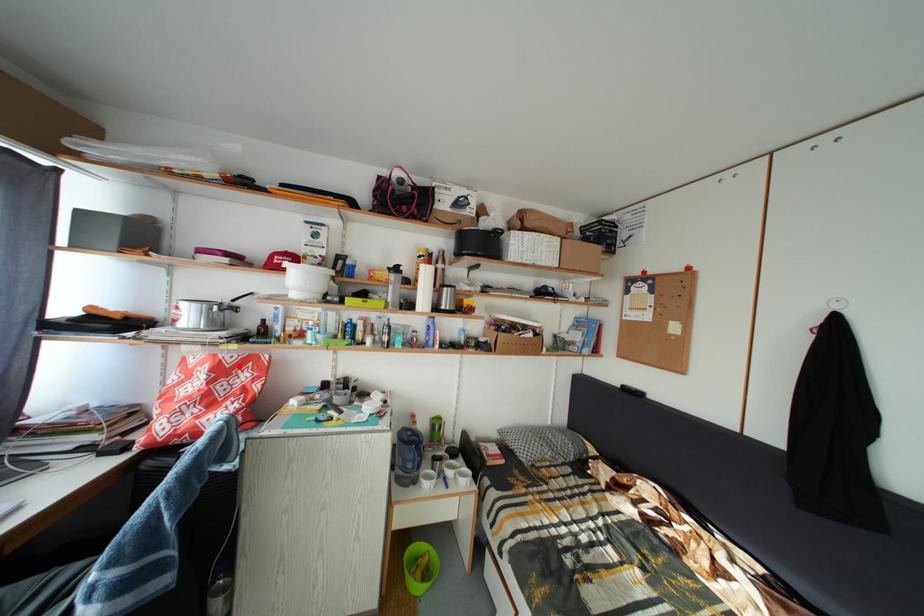
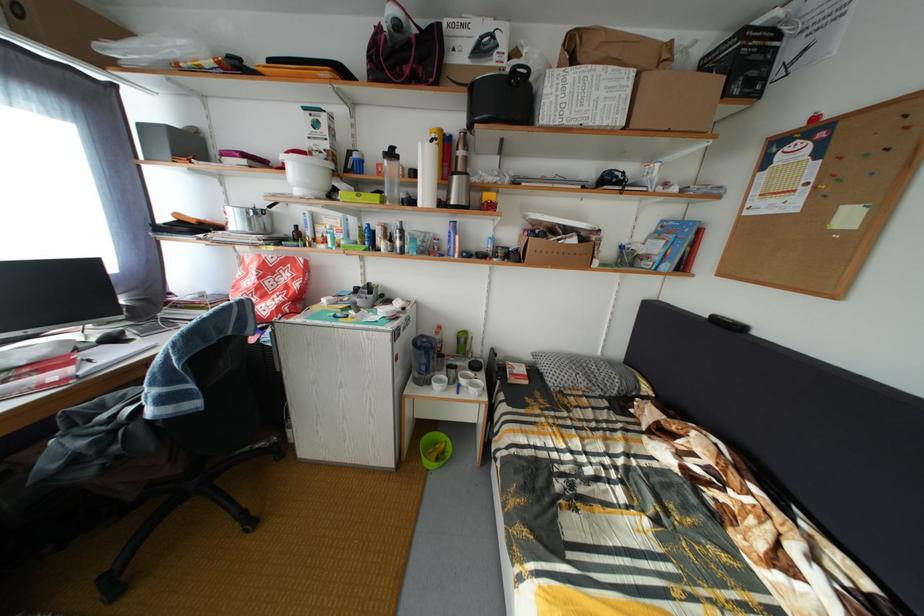
Locate, in the second image, the point that corresponds to the highlighted location in the first image.

(281, 267)